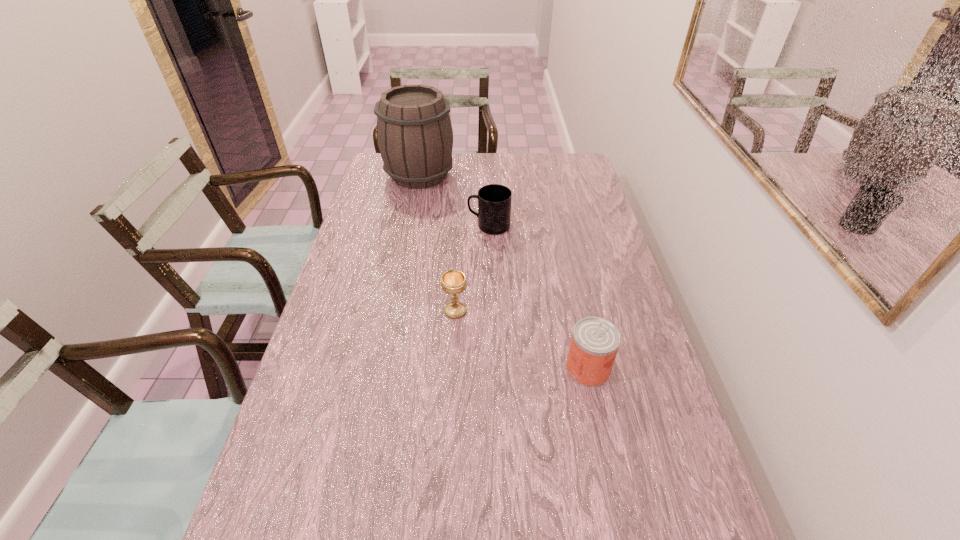
The height and width of the screenshot is (540, 960). I want to click on vacant area situated 0.170m on the front of the rightmost object, so click(x=607, y=455).

This screenshot has height=540, width=960. In order to click on vacant region located on the back of the third farthest object in this screenshot , I will do `click(459, 244)`.

Locate an element on the screen. This screenshot has height=540, width=960. object present at the far edge is located at coordinates (414, 132).

At what (x,y) coordinates should I click in order to perform the action: click on object that is at the left edge. Please return your answer as a coordinate pair (x, y). The image size is (960, 540). Looking at the image, I should click on (414, 132).

The height and width of the screenshot is (540, 960). I want to click on object that is at the right edge, so click(595, 341).

At what (x,y) coordinates should I click in order to perform the action: click on object that is at the far left corner. Please return your answer as a coordinate pair (x, y). This screenshot has height=540, width=960. Looking at the image, I should click on (414, 132).

This screenshot has width=960, height=540. In the image, there is a desktop. Identify the location of vacant area at the far edge. (541, 166).

The height and width of the screenshot is (540, 960). In the image, there is a desktop. In order to click on free space at the left edge in this screenshot , I will do pos(310,390).

Identify the location of blank space at the right edge of the desktop. This screenshot has width=960, height=540. (569, 210).

The height and width of the screenshot is (540, 960). In order to click on vacant space at the far left corner in this screenshot , I will do `click(372, 168)`.